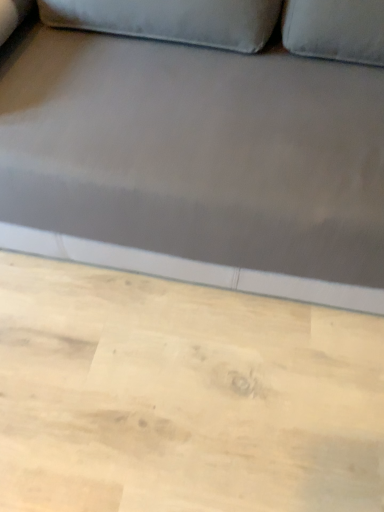
The height and width of the screenshot is (512, 384). I want to click on light wood plywood at lower center, so click(182, 396).

Describe the element at coordinates (182, 396) in the screenshot. I see `light wood plywood at lower center` at that location.

The image size is (384, 512). What are the coordinates of `satin gray fabric couch at center` in the screenshot? It's located at (196, 165).

What do you see at coordinates (196, 165) in the screenshot? I see `satin gray fabric couch at center` at bounding box center [196, 165].

Where is `light wood plywood at lower center`? light wood plywood at lower center is located at coordinates (182, 396).

Considering the positions of objects light wood plywood at lower center and satin gray fabric couch at center in the image provided, who is more to the right, light wood plywood at lower center or satin gray fabric couch at center?

From the viewer's perspective, satin gray fabric couch at center appears more on the right side.

Is light wood plywood at lower center in front of or behind satin gray fabric couch at center in the image?

In the image, light wood plywood at lower center appears behind satin gray fabric couch at center.

Is point (270, 406) in front of point (129, 102)?

No, it is not.

From the image's perspective, is light wood plywood at lower center located above or below satin gray fabric couch at center?

Based on their image positions, light wood plywood at lower center is located beneath satin gray fabric couch at center.

From a real-world perspective, who is located higher, light wood plywood at lower center or satin gray fabric couch at center?

From a 3D spatial view, satin gray fabric couch at center is above.

Looking at their sizes, would you say light wood plywood at lower center is wider or thinner than satin gray fabric couch at center?

Clearly, light wood plywood at lower center has more width compared to satin gray fabric couch at center.

Looking at this image, considering the sizes of light wood plywood at lower center and satin gray fabric couch at center in the image, is light wood plywood at lower center taller or shorter than satin gray fabric couch at center?

In the image, light wood plywood at lower center appears to be shorter than satin gray fabric couch at center.

Who is bigger, light wood plywood at lower center or satin gray fabric couch at center?

satin gray fabric couch at center is bigger.

Is satin gray fabric couch at center located within light wood plywood at lower center?

That's incorrect, satin gray fabric couch at center is not inside light wood plywood at lower center.

Is light wood plywood at lower center not near satin gray fabric couch at center?

That's not correct — light wood plywood at lower center is a little close to satin gray fabric couch at center.

Is light wood plywood at lower center oriented towards satin gray fabric couch at center?

No, light wood plywood at lower center is not turned towards satin gray fabric couch at center.

This screenshot has height=512, width=384. In the image, there is a satin gray fabric couch at center. Identify the location of plywood below it (from the image's perspective). (182, 396).

Can you confirm if satin gray fabric couch at center is positioned to the left of light wood plywood at lower center?

Incorrect, satin gray fabric couch at center is not on the left side of light wood plywood at lower center.

Is satin gray fabric couch at center in front of or behind light wood plywood at lower center in the image?

Clearly, satin gray fabric couch at center is in front of light wood plywood at lower center.

Is point (119, 257) farther from viewer compared to point (67, 380)?

Yes, point (119, 257) is farther from viewer.

From the image's perspective, between satin gray fabric couch at center and light wood plywood at lower center, which one is located above?

satin gray fabric couch at center is shown above in the image.

From a real-world perspective, which object rests below the other?

In real-world perspective, light wood plywood at lower center is lower.

Does satin gray fabric couch at center have a greater width compared to light wood plywood at lower center?

In fact, satin gray fabric couch at center might be narrower than light wood plywood at lower center.

Considering the relative sizes of satin gray fabric couch at center and light wood plywood at lower center in the image provided, is satin gray fabric couch at center shorter than light wood plywood at lower center?

No, satin gray fabric couch at center is not shorter than light wood plywood at lower center.

Is satin gray fabric couch at center smaller than light wood plywood at lower center?

Actually, satin gray fabric couch at center might be larger than light wood plywood at lower center.

Can light wood plywood at lower center be found inside satin gray fabric couch at center?

No, light wood plywood at lower center is not inside satin gray fabric couch at center.

Is satin gray fabric couch at center next to light wood plywood at lower center?

No, satin gray fabric couch at center is not in contact with light wood plywood at lower center.

Is satin gray fabric couch at center facing away from light wood plywood at lower center?

satin gray fabric couch at center does not have its back to light wood plywood at lower center.

How far apart are satin gray fabric couch at center and light wood plywood at lower center?

They are 38.75 centimeters apart.

Where is `plywood on the left of satin gray fabric couch at center`? The width and height of the screenshot is (384, 512). plywood on the left of satin gray fabric couch at center is located at coordinates (182, 396).

Locate an element on the screen. studio couch above the light wood plywood at lower center (from the image's perspective) is located at coordinates (196, 165).

Locate an element on the screen. This screenshot has height=512, width=384. studio couch above the light wood plywood at lower center (from a real-world perspective) is located at coordinates (196, 165).